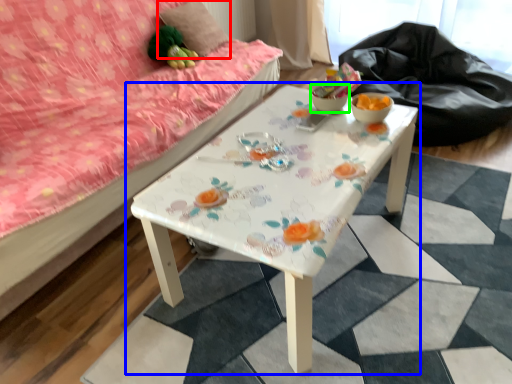
Question: Which is farther away from pillow (highlighted by a red box)? table (highlighted by a blue box) or glass bowl (highlighted by a green box)?

Choices:
 (A) table
 (B) glass bowl

Answer: (A)